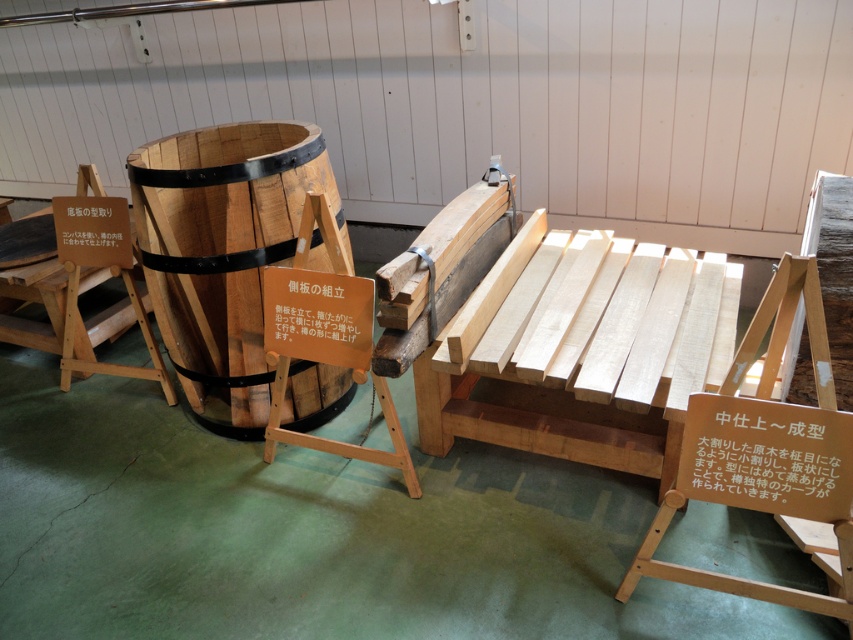
You are a visitor in the workshop and want to sit down. You see the natural wood barrel at center and the light brown wood chair at center. Which object is closer to your left side if you are facing the scene?

The natural wood barrel at center is to the left of the light brown wood chair at center, so if you are facing the scene, the natural wood barrel at center would be closer to your left side.

Looking at this image, you are a visitor standing in front of the light brown wood chair at center in the workshop. You want to take a photo of the chair without moving any objects. Can you comfortably take a photo from your current position?

Yes, because the light brown wood chair at center is 1.35 meters away from the camera, which is a comfortable distance for taking a photo without needing to move any objects.

You are an interior designer planning to place both the natural wood barrel at center and the light brown wood chair at center in a cozy living room. Given their sizes, which one would you recommend placing near the entrance to maximize space efficiency?

The natural wood barrel at center is larger in size than the light brown wood chair at center, so placing the smaller light brown wood chair at center near the entrance would be more space efficient.